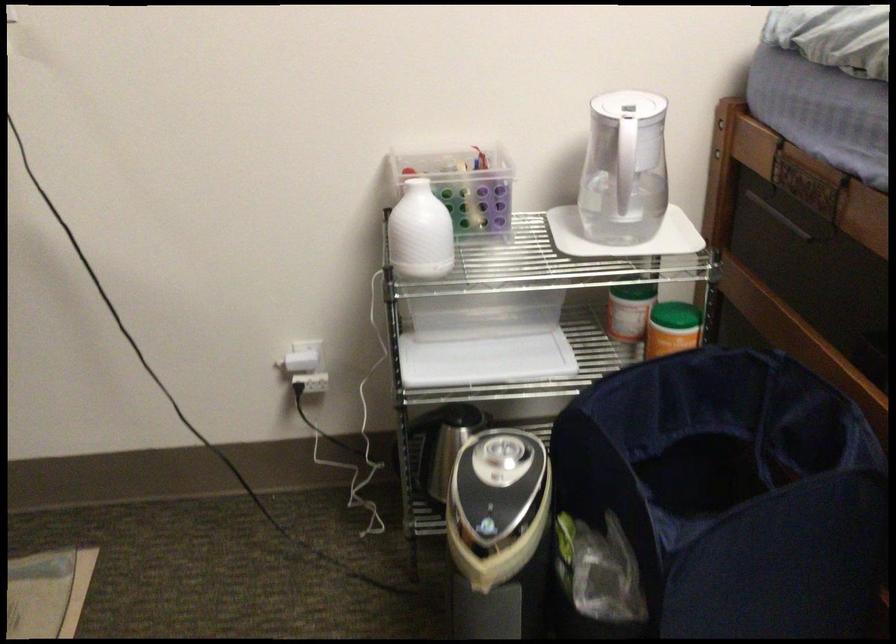
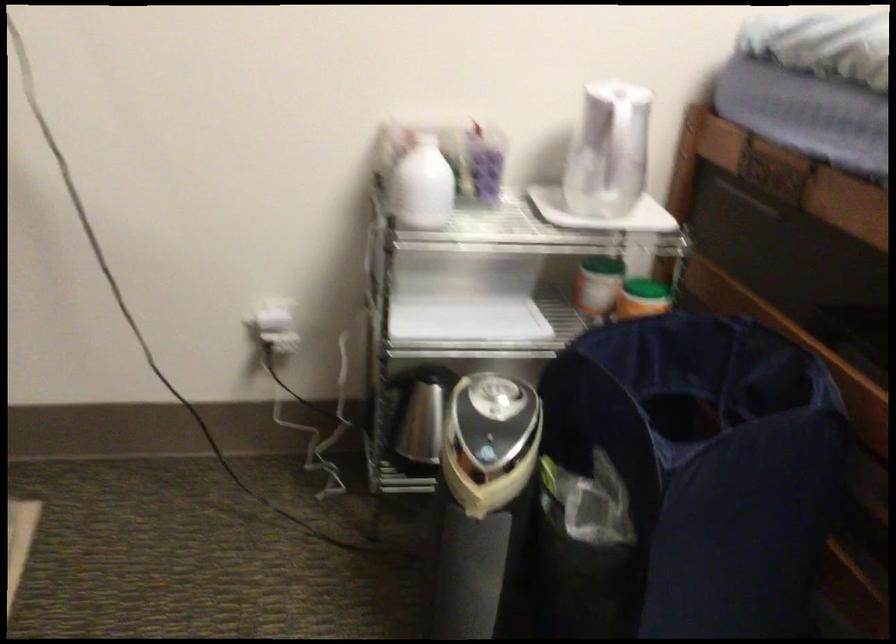
Find the pixel in the second image that matches point (616, 174) in the first image.

(607, 151)